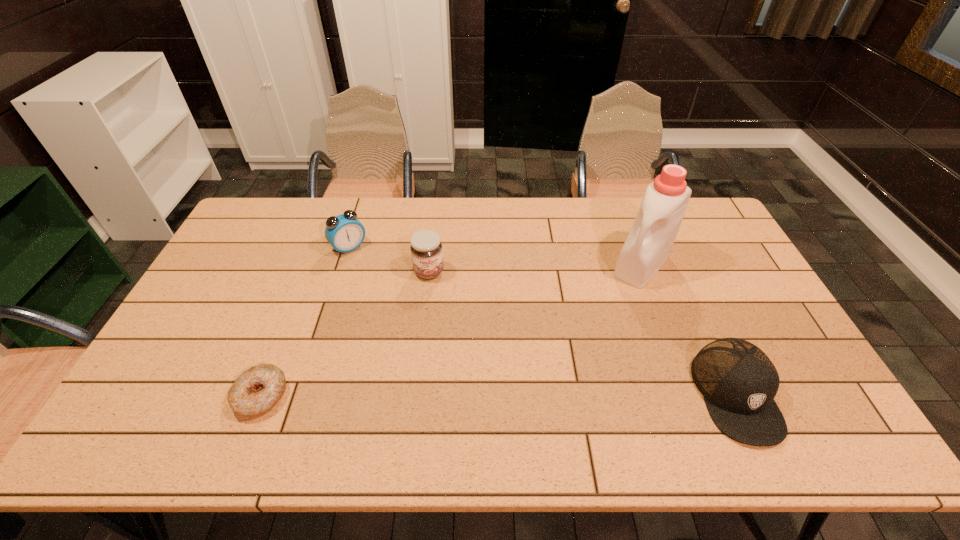
You are a GUI agent. You are given a task and a screenshot of the screen. Output one action in this format:
    pyautogui.click(x=<x>, y=<y>)
    Task: Click on the blank space located on the face of the alarm clock
    
    Given the screenshot: What is the action you would take?
    pyautogui.click(x=385, y=287)

You are a GUI agent. You are given a task and a screenshot of the screen. Output one action in this format:
    pyautogui.click(x=<x>, y=<y>)
    Task: Click on the vacant space located 0.320m on the face of the alarm clock
    The height and width of the screenshot is (540, 960).
    Given the screenshot: What is the action you would take?
    pyautogui.click(x=408, y=315)

You are a GUI agent. You are given a task and a screenshot of the screen. Output one action in this format:
    pyautogui.click(x=<x>, y=<y>)
    Task: Click on the vacant region located 0.320m on the handle side of the detergent
    
    Given the screenshot: What is the action you would take?
    pyautogui.click(x=574, y=348)

The width and height of the screenshot is (960, 540). I want to click on vacant region located on the handle side of the detergent, so click(x=588, y=330).

Locate an element on the screen. The height and width of the screenshot is (540, 960). blank area located on the handle side of the detergent is located at coordinates (588, 330).

Find the location of a particular element. object at the far edge is located at coordinates (344, 232).

Identify the location of doughnut that is positioned at the near edge. This screenshot has height=540, width=960. (258, 389).

Where is `cap located in the near edge section of the desktop`? cap located in the near edge section of the desktop is located at coordinates (738, 381).

This screenshot has height=540, width=960. What are the coordinates of `object located in the right edge section of the desktop` in the screenshot? It's located at (738, 381).

Locate an element on the screen. The image size is (960, 540). object positioned at the near right corner is located at coordinates (738, 381).